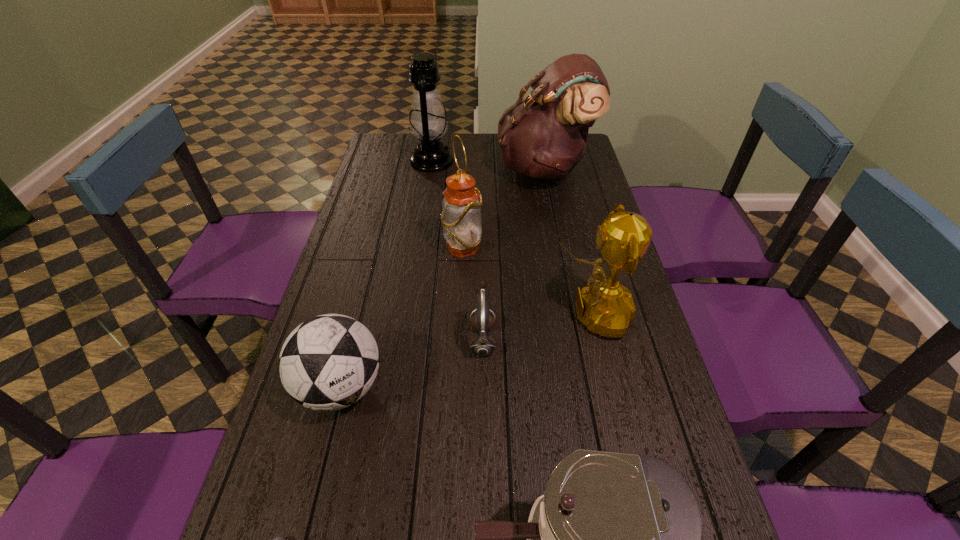
The image size is (960, 540). What are the coordinates of `blank space located 0.150m on the right of the sixth nearest object` in the screenshot? It's located at (530, 248).

The height and width of the screenshot is (540, 960). Identify the location of vacant space located on the front side of the award. (507, 314).

Locate an element on the screen. This screenshot has width=960, height=540. vacant space located 0.130m on the front side of the award is located at coordinates (504, 314).

This screenshot has width=960, height=540. In order to click on vacant space located on the front side of the award in this screenshot , I will do `click(412, 314)`.

This screenshot has width=960, height=540. Identify the location of vacant space situated 0.150m on the surface of the soccer ball where the brand logo is visible. (312, 502).

This screenshot has height=540, width=960. Find the location of `free space located 0.370m on the ear pads of the seventh tallest object`. free space located 0.370m on the ear pads of the seventh tallest object is located at coordinates (326, 339).

Identify the location of vacant space located 0.150m on the ear pads of the seventh tallest object. The image size is (960, 540). (412, 339).

Where is `free location located on the ear pads of the seventh tallest object`? free location located on the ear pads of the seventh tallest object is located at coordinates (450, 339).

I want to click on satchel located in the far edge section of the desktop, so click(x=544, y=136).

Identify the location of oil lamp situated at the far edge. This screenshot has width=960, height=540. (428, 122).